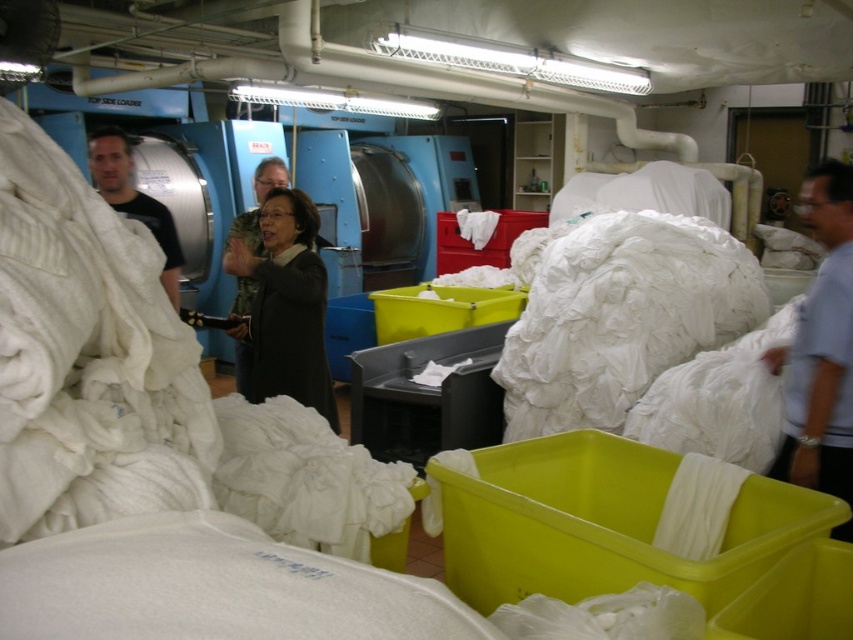
Measure the distance between point (840,323) and camera.

They are 7.46 feet apart.

Is light blue shirt at right thinner than dark gray sweater at center?

No.

Which is behind, point (810, 189) or point (239, 353)?

Point (239, 353)

You are a GUI agent. You are given a task and a screenshot of the screen. Output one action in this format:
    pyautogui.click(x=<x>, y=<y>)
    Task: Click on the light blue shirt at right
    
    Given the screenshot: What is the action you would take?
    pyautogui.click(x=821, y=346)

From the picture: Which is more to the right, black fabric at center or black matte shirt at left?

black fabric at center

Who is higher up, black fabric at center or black matte shirt at left?

black matte shirt at left is higher up.

Is point (241, 244) in front of point (102, 195)?

Yes, point (241, 244) is in front of point (102, 195).

What are the coordinates of `black fabric at center` in the screenshot? It's located at (286, 305).

Does black fabric at center come behind dark gray sweater at center?

No, it is in front of dark gray sweater at center.

Is black fabric at center bigger than dark gray sweater at center?

Yes.

Between point (287, 205) and point (273, 177), which one is positioned behind?

The point (273, 177) is more distant.

Locate an element on the screen. The image size is (853, 640). black fabric at center is located at coordinates (286, 305).